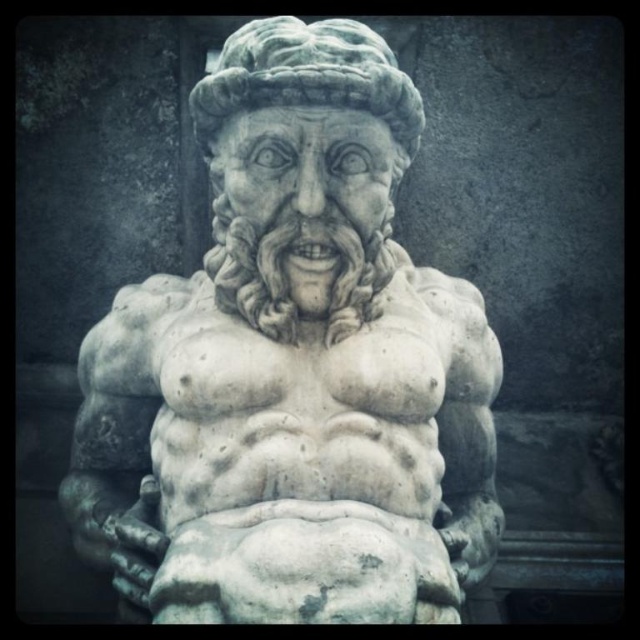
Locate an element on the screen. white marble statue at center is located at coordinates (292, 369).

Which is behind, point (225, 250) or point (342, 52)?

Positioned behind is point (225, 250).

Between point (406, 413) and point (240, 74), which one is positioned in front?

Point (240, 74) is in front.

Find the location of a particular element. The height and width of the screenshot is (640, 640). white marble statue at center is located at coordinates (292, 369).